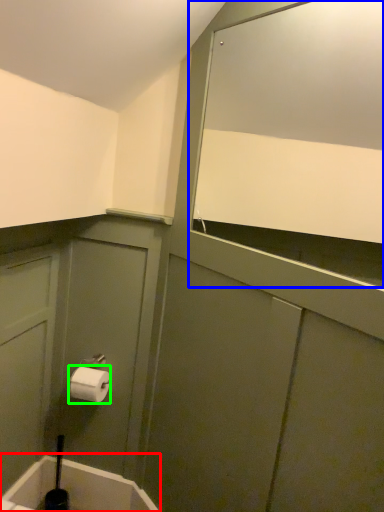
Question: Which object is positioned closest to bath (highlighted by a red box)? Select from mirror (highlighted by a blue box) and toilet paper (highlighted by a green box).

Choices:
 (A) mirror
 (B) toilet paper

Answer: (B)